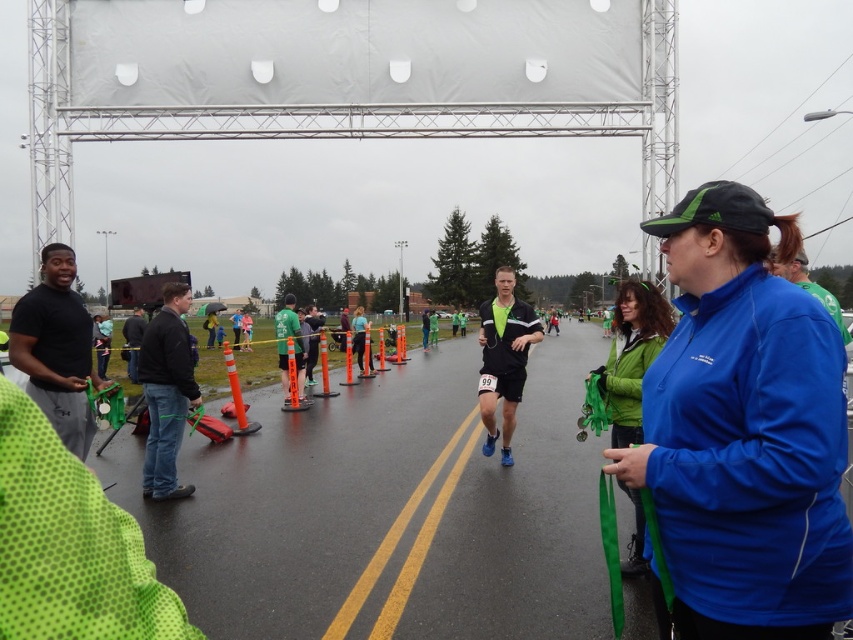
You are a photographer positioned at the center of the image. You need to capture a photo that includes both the blue fleece jacket at right and the green fleece jacket at right. Which direction should you move to ensure both jackets are in the frame?

Since the blue fleece jacket at right is to the left of the green fleece jacket at right, you should move to the right to ensure both jackets are in the frame.

You are a participant in the marathon and you see two points marked in the image. The first point is at coordinate point (648, 465) and the second is at coordinate point (670, 326). Which point is closer to you?

Point (648, 465) is closer to the viewer than point (670, 326).

You are a photographer at the marathon event and need to capture a photo of both the blue fleece jacket at right and the green fleece jacket at right. Which jacket should you focus on first if you want to include both in the frame without adjusting your camera angle?

The blue fleece jacket at right is shorter than the green fleece jacket at right, so you should focus on the blue fleece jacket at right first to ensure it is fully visible in the frame before the taller green fleece jacket at right might block it.